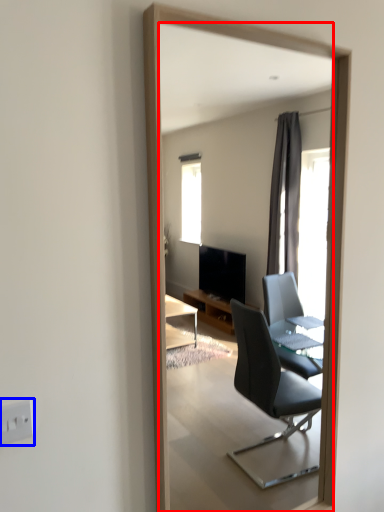
Question: Among these objects, which one is nearest to the camera, mirror (highlighted by a red box) or electric outlet (highlighted by a blue box)?

Choices:
 (A) mirror
 (B) electric outlet

Answer: (B)